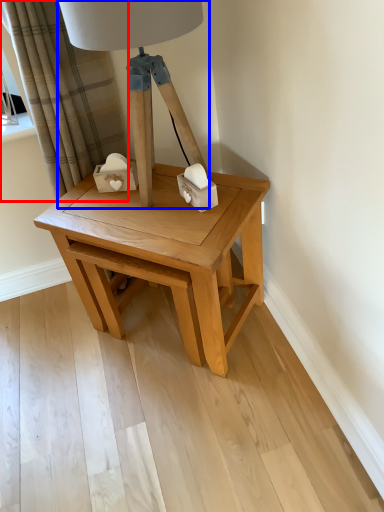
Question: Among these objects, which one is nearest to the camera, curtain (highlighted by a red box) or table lamp (highlighted by a blue box)?

Choices:
 (A) curtain
 (B) table lamp

Answer: (B)